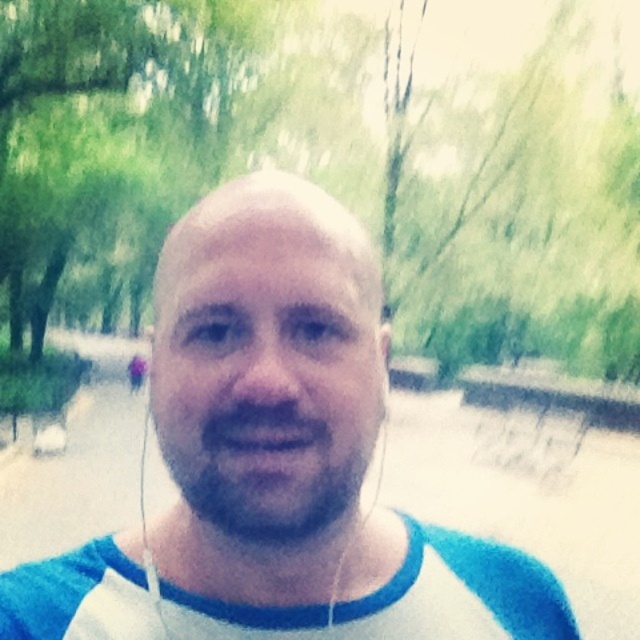
Question: Can you confirm if white fabric shirt at center is positioned to the right of beardsoftat center?

Choices:
 (A) yes
 (B) no

Answer: (A)

Question: Which point appears farthest from the camera in this image?

Choices:
 (A) (465, 540)
 (B) (387, 422)

Answer: (B)

Question: Can you confirm if white fabric shirt at center is positioned to the right of beardsoftat center?

Choices:
 (A) yes
 (B) no

Answer: (A)

Question: Does white fabric shirt at center have a smaller size compared to beardsoftat center?

Choices:
 (A) no
 (B) yes

Answer: (B)

Question: Which point is farther to the camera?

Choices:
 (A) white fabric shirt at center
 (B) beardsoftat center

Answer: (B)